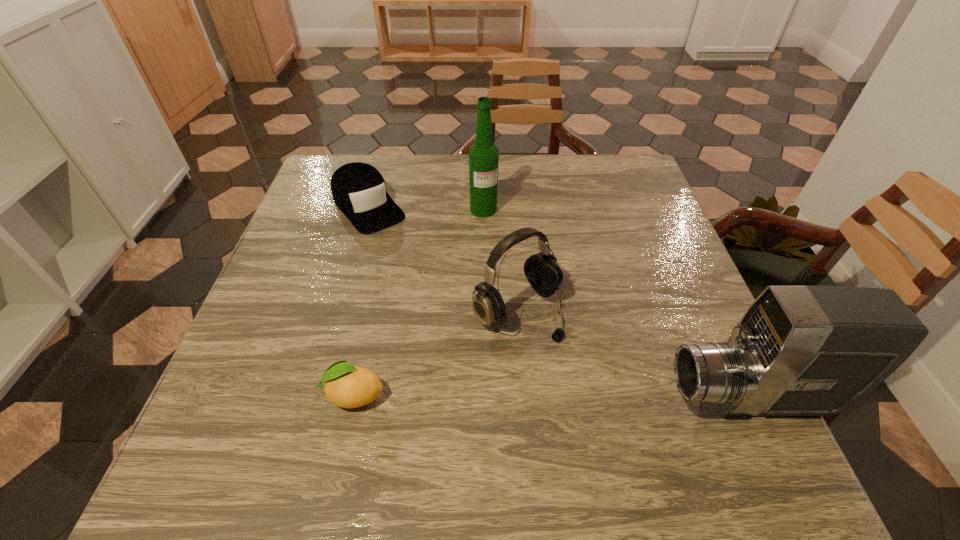
The image size is (960, 540). In the image, there is a desktop. Find the location of `vacant area at the left edge`. vacant area at the left edge is located at coordinates (250, 330).

Identify the location of free space at the right edge of the desktop. (611, 240).

Locate an element on the screen. This screenshot has width=960, height=540. vacant region at the far left corner of the desktop is located at coordinates (372, 155).

Image resolution: width=960 pixels, height=540 pixels. In order to click on free space at the near left corner in this screenshot , I will do `click(251, 391)`.

This screenshot has height=540, width=960. In the image, there is a desktop. Find the location of `free region at the far right corner`. free region at the far right corner is located at coordinates (614, 153).

The width and height of the screenshot is (960, 540). I want to click on free point between the fourth tallest object and the beer bottle, so click(426, 208).

Find the location of `vacant area that lies between the rightmost object and the tallest object`. vacant area that lies between the rightmost object and the tallest object is located at coordinates (616, 304).

You are a GUI agent. You are given a task and a screenshot of the screen. Output one action in this format:
    pyautogui.click(x=<x>, y=<y>)
    Task: Click on the vacant area that lies between the camcorder and the beer bottle
    
    Given the screenshot: What is the action you would take?
    (616, 304)

Image resolution: width=960 pixels, height=540 pixels. I want to click on free spot between the third shortest object and the camcorder, so click(633, 355).

Find the location of a particular element. The image size is (960, 540). free area in between the fourth tallest object and the third shortest object is located at coordinates (444, 259).